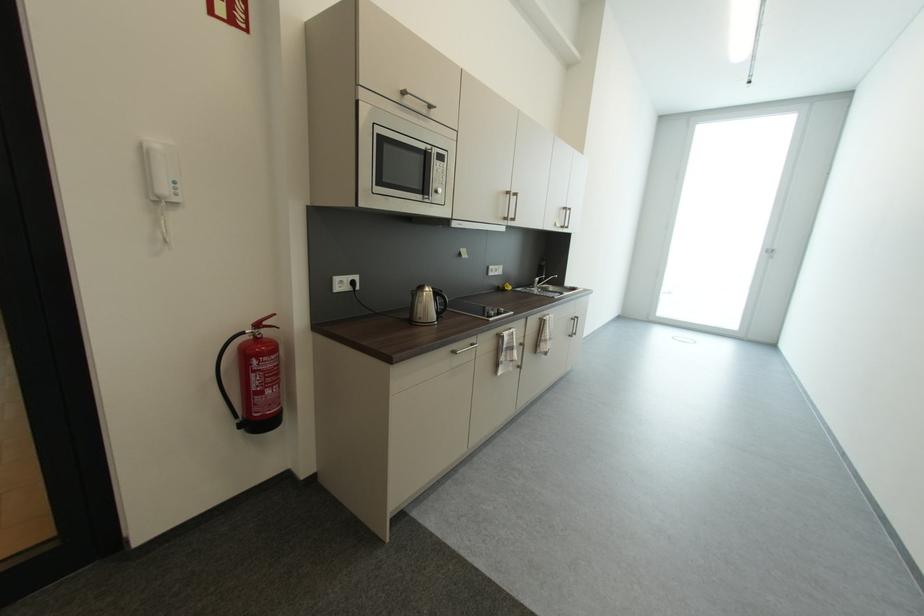
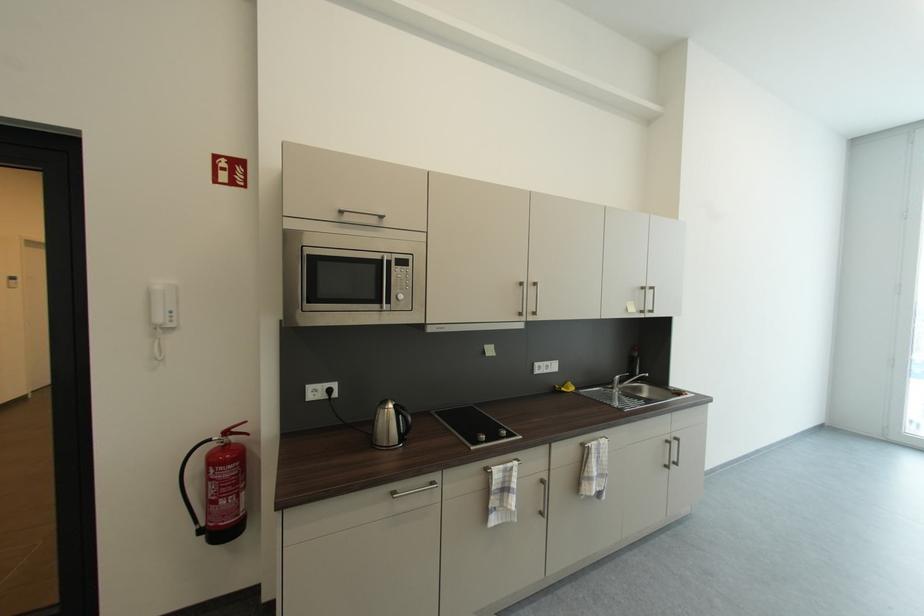
Locate, in the second image, the point that corresponds to point (444, 155) in the first image.

(403, 261)